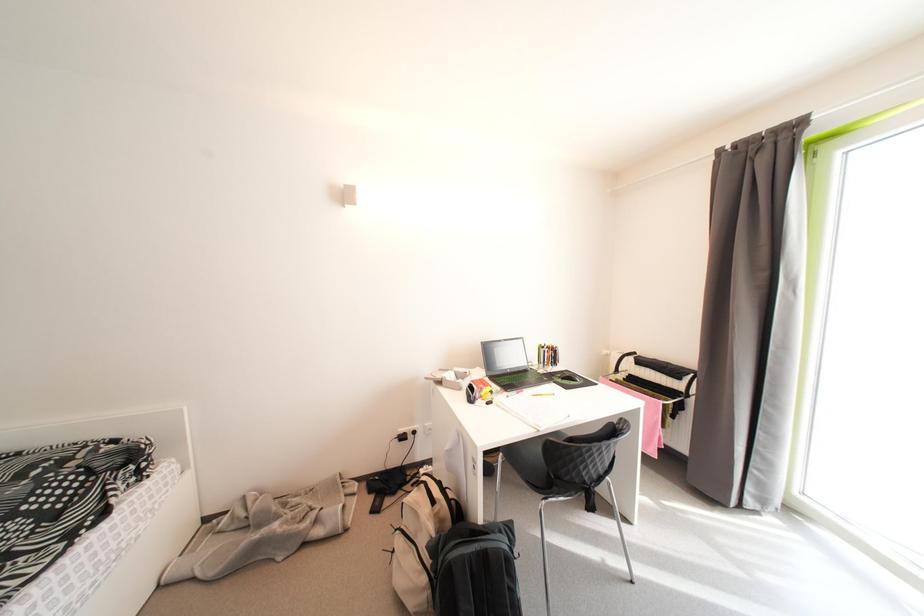
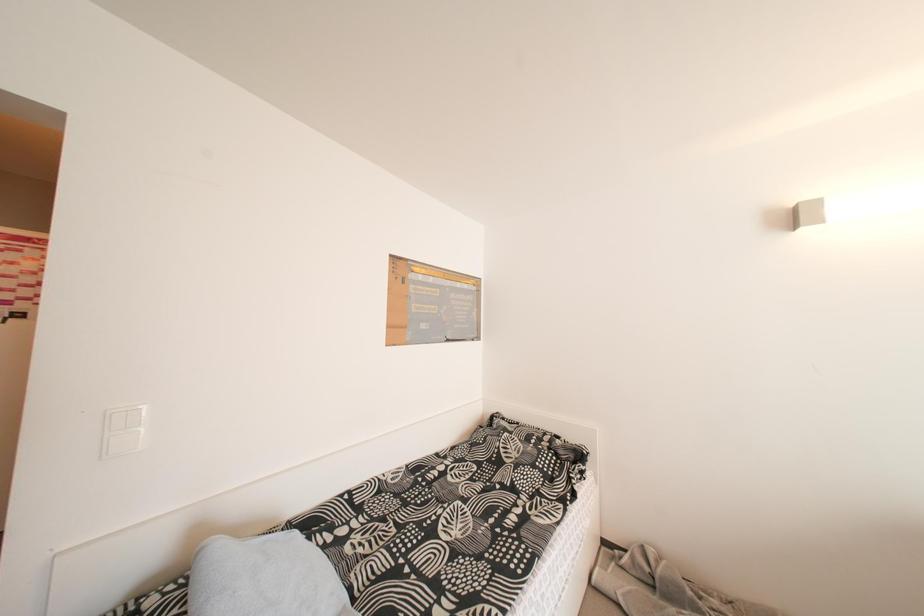
Question: The camera is either moving clockwise (left) or counter-clockwise (right) around the object. The first image is from the beginning of the video and the second image is from the end. Is the camera moving left or right when shooting the video?

Choices:
 (A) Left
 (B) Right

Answer: (B)